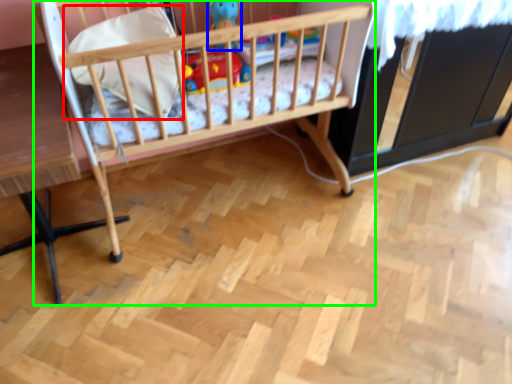
Question: Which is nearer to the pillow (highlighted by a red box)? toy (highlighted by a blue box) or infant bed (highlighted by a green box).

Choices:
 (A) toy
 (B) infant bed

Answer: (B)